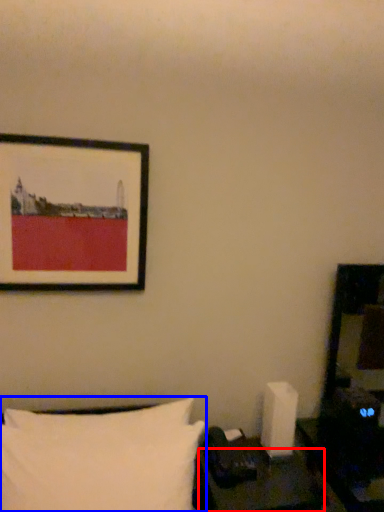
Question: Among these objects, which one is nearest to the camera, table (highlighted by a red box) or pillow (highlighted by a blue box)?

Choices:
 (A) table
 (B) pillow

Answer: (B)